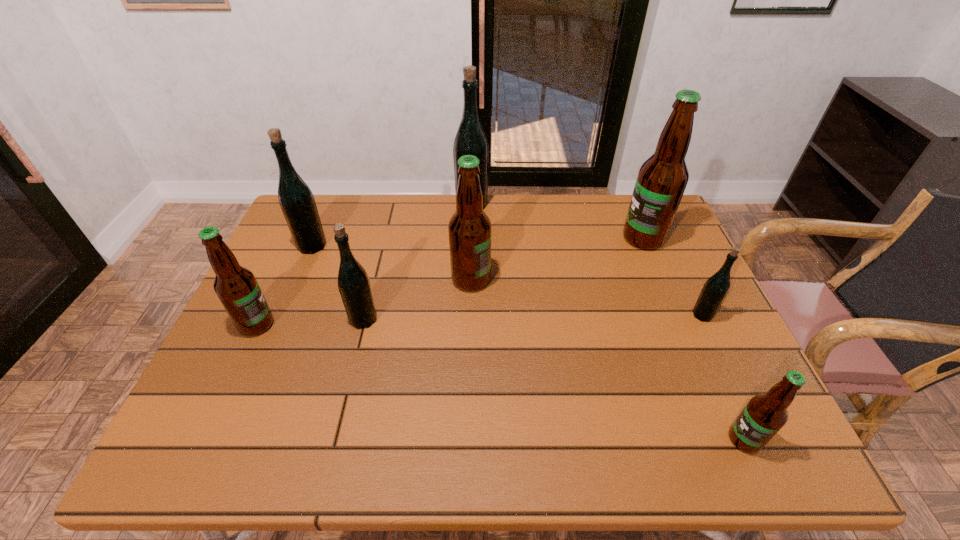
You are a GUI agent. You are given a task and a screenshot of the screen. Output one action in this format:
    pyautogui.click(x=<x>, y=<y>)
    Task: Click on the brown beer bottle object that ranks as the second closest to the farthest beer bottle
    This screenshot has width=960, height=540.
    Given the screenshot: What is the action you would take?
    pyautogui.click(x=661, y=181)

Locate which brown beer bottle is the second closest to the nearest beer bottle. Please provide its 2D coordinates. Your answer should be formatted as a tuple, i.e. [(x, y)], where the tuple contains the x and y coordinates of a point satisfying the conditions above.

[(469, 228)]

You are a GUI agent. You are given a task and a screenshot of the screen. Output one action in this format:
    pyautogui.click(x=<x>, y=<y>)
    Task: Click on the free space that satisfies the following two spatial constraints: 1. on the label of the fourth farthest object; 2. on the right side of the smallest green beer bottle
    This screenshot has height=540, width=960.
    Given the screenshot: What is the action you would take?
    pyautogui.click(x=470, y=315)